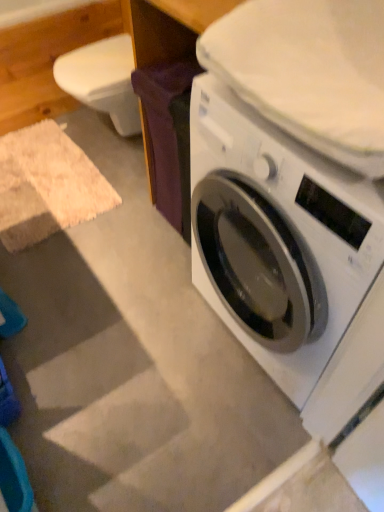
You are a GUI agent. You are given a task and a screenshot of the screen. Output one action in this format:
    pyautogui.click(x=<x>, y=<y>)
    Task: Click on the purple fabric at center
    The width and height of the screenshot is (384, 512).
    Given the screenshot: What is the action you would take?
    pyautogui.click(x=169, y=94)

Measure the distance between purple fabric at center and camera.

purple fabric at center and camera are 35.59 inches apart.

Describe the element at coordinates (169, 94) in the screenshot. I see `purple fabric at center` at that location.

Where is `white glossy washing machine at lower right`? The width and height of the screenshot is (384, 512). white glossy washing machine at lower right is located at coordinates (299, 210).

Describe the element at coordinates (299, 210) in the screenshot. Image resolution: width=384 pixels, height=512 pixels. I see `white glossy washing machine at lower right` at that location.

In order to face white glossy washing machine at lower right, should I rotate leftwards or rightwards?

Turn right by 17.625 degrees to look at white glossy washing machine at lower right.

At what (x,y) coordinates should I click in order to perform the action: click on purple fabric at center. Please return your answer as a coordinate pair (x, y). This screenshot has height=512, width=384. Looking at the image, I should click on (169, 94).

Considering the relative positions of white glossy washing machine at lower right and purple fabric at center in the image provided, is white glossy washing machine at lower right to the right of purple fabric at center from the viewer's perspective?

Yes.

Is white glossy washing machine at lower right positioned in front of purple fabric at center?

Yes, white glossy washing machine at lower right is closer to the camera.

Which point is more distant from viewer, (206,291) or (173,195)?

The point (173,195) is farther.

From the image's perspective, relative to purple fabric at center, is white glossy washing machine at lower right above or below?

From the image's perspective, white glossy washing machine at lower right appears below purple fabric at center.

From the picture: From a real-world perspective, does white glossy washing machine at lower right sit lower than purple fabric at center?

Actually, white glossy washing machine at lower right is physically above purple fabric at center in the real world.

Considering the relative sizes of white glossy washing machine at lower right and purple fabric at center in the image provided, is white glossy washing machine at lower right wider than purple fabric at center?

Correct, the width of white glossy washing machine at lower right exceeds that of purple fabric at center.

Who is shorter, white glossy washing machine at lower right or purple fabric at center?

purple fabric at center.

Does white glossy washing machine at lower right have a smaller size compared to purple fabric at center?

Actually, white glossy washing machine at lower right might be larger than purple fabric at center.

Could purple fabric at center be considered to be inside white glossy washing machine at lower right?

No, purple fabric at center is not inside white glossy washing machine at lower right.

Is there a large distance between white glossy washing machine at lower right and purple fabric at center?

white glossy washing machine at lower right is near purple fabric at center, not far away.

Is purple fabric at center at the back of white glossy washing machine at lower right?

No, white glossy washing machine at lower right's orientation is not away from purple fabric at center.

How different are the orientations of white glossy washing machine at lower right and purple fabric at center in degrees?

0.979 degrees separate the facing orientations of white glossy washing machine at lower right and purple fabric at center.

Measure the distance from white glossy washing machine at lower right to purple fabric at center.

white glossy washing machine at lower right and purple fabric at center are 36.60 centimeters apart.

Where is `table that is on the left side of white glossy washing machine at lower right`? The image size is (384, 512). table that is on the left side of white glossy washing machine at lower right is located at coordinates [x=169, y=94].

Can you confirm if purple fabric at center is positioned to the left of white glossy washing machine at lower right?

Indeed, purple fabric at center is positioned on the left side of white glossy washing machine at lower right.

Is purple fabric at center positioned before white glossy washing machine at lower right?

No.

Is point (144, 71) positioned in front of point (306, 335)?

No, it is behind (306, 335).

From the image's perspective, which is above, purple fabric at center or white glossy washing machine at lower right?

purple fabric at center is shown above in the image.

From a real-world perspective, is purple fabric at center positioned under white glossy washing machine at lower right based on gravity?

Yes, from a real-world perspective, purple fabric at center is beneath white glossy washing machine at lower right.

In terms of width, does purple fabric at center look wider or thinner when compared to white glossy washing machine at lower right?

purple fabric at center is thinner than white glossy washing machine at lower right.

In terms of height, does purple fabric at center look taller or shorter compared to white glossy washing machine at lower right?

Considering their sizes, purple fabric at center has less height than white glossy washing machine at lower right.

Between purple fabric at center and white glossy washing machine at lower right, which one has smaller size?

purple fabric at center.

From the picture: Is purple fabric at center inside or outside of white glossy washing machine at lower right?

purple fabric at center lies outside white glossy washing machine at lower right.

Is purple fabric at center not near white glossy washing machine at lower right?

No, purple fabric at center is not far away from white glossy washing machine at lower right.

Is purple fabric at center facing away from white glossy washing machine at lower right?

purple fabric at center is not turned away from white glossy washing machine at lower right.

Can you tell me how much purple fabric at center and white glossy washing machine at lower right differ in facing direction?

0.979 degrees separate the facing orientations of purple fabric at center and white glossy washing machine at lower right.

Find the location of `washing machine below the purple fabric at center (from the image's perspective)`. washing machine below the purple fabric at center (from the image's perspective) is located at coordinates (299, 210).

This screenshot has width=384, height=512. Find the location of `washing machine that is on the right side of purple fabric at center`. washing machine that is on the right side of purple fabric at center is located at coordinates (299, 210).

Where is `washing machine located below the purple fabric at center (from the image's perspective)`? Image resolution: width=384 pixels, height=512 pixels. washing machine located below the purple fabric at center (from the image's perspective) is located at coordinates (299, 210).